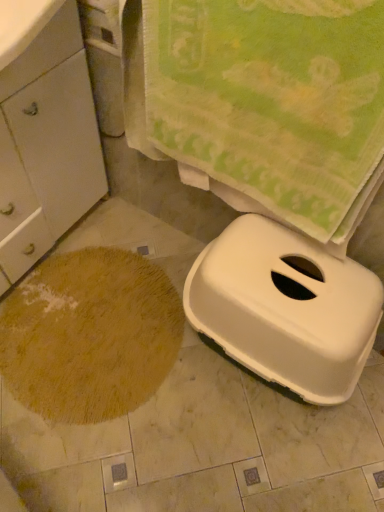
Locate an element on the screen. free space that is in between white plastic litter box at lower right and brown shaggy rug at lower left is located at coordinates (190, 389).